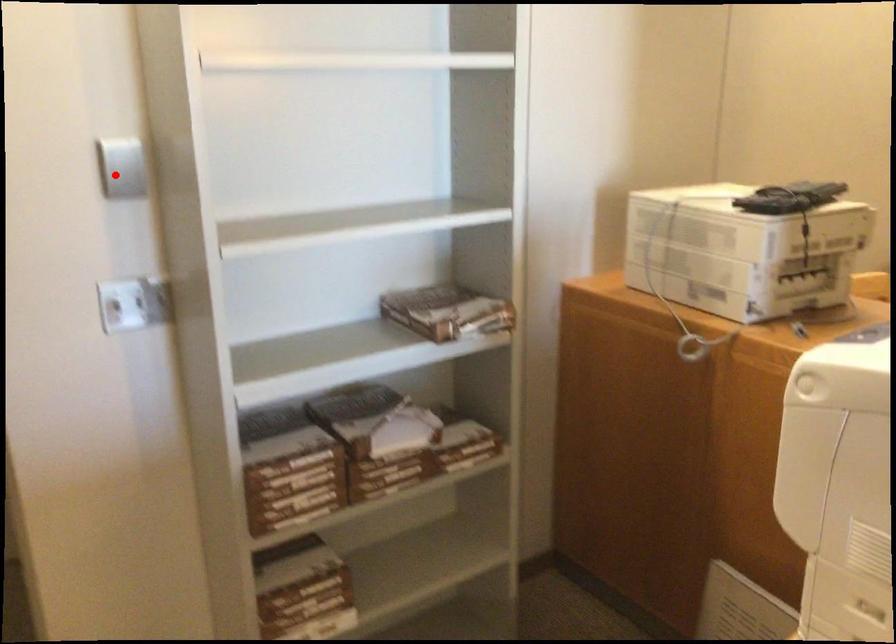
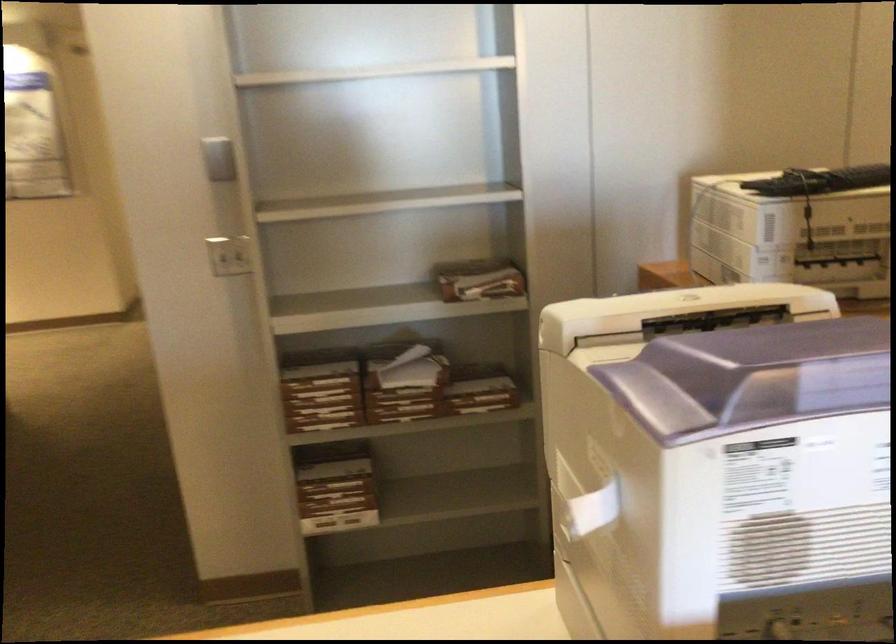
Locate, in the second image, the point that corresponds to the highlighted location in the first image.

(219, 158)